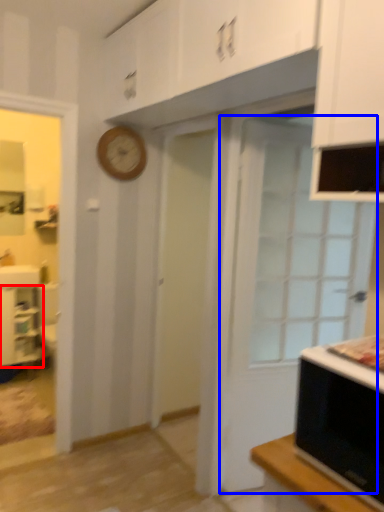
Question: Which object appears closest to the camera in this image, cabinetry (highlighted by a red box) or door (highlighted by a blue box)?

Choices:
 (A) cabinetry
 (B) door

Answer: (B)